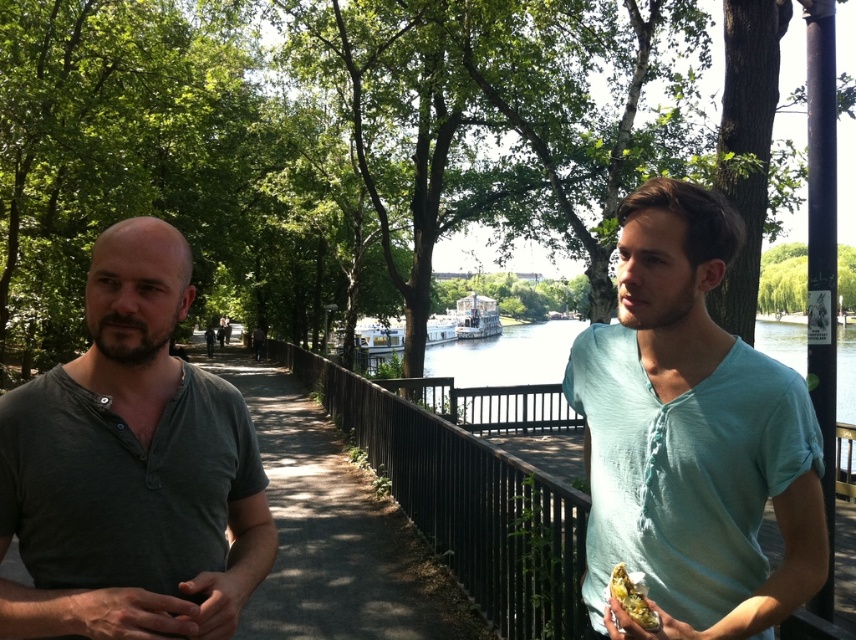
Question: Observing the image, what is the correct spatial positioning of dark gray cotton shirt at left in reference to shiny foil food at right?

Choices:
 (A) above
 (B) below

Answer: (A)

Question: Among these objects, which one is farthest from the camera?

Choices:
 (A) black metal fence at center
 (B) light blue cotton shirt at right
 (C) shiny foil food at right

Answer: (A)

Question: Which point is farther to the camera?

Choices:
 (A) (578, 416)
 (B) (617, 392)
 (C) (153, 522)

Answer: (A)

Question: Is clear water at center above light blue shirt at center?

Choices:
 (A) no
 (B) yes

Answer: (A)

Question: Considering the real-world distances, which object is farthest from the matte yellow food at lower right?

Choices:
 (A) light blue cotton shirt at right
 (B) light blue shirt at center
 (C) clear water at center
 (D) black metal fence at center

Answer: (B)

Question: Does matte yellow food at lower right appear under light blue shirt at center?

Choices:
 (A) yes
 (B) no

Answer: (B)